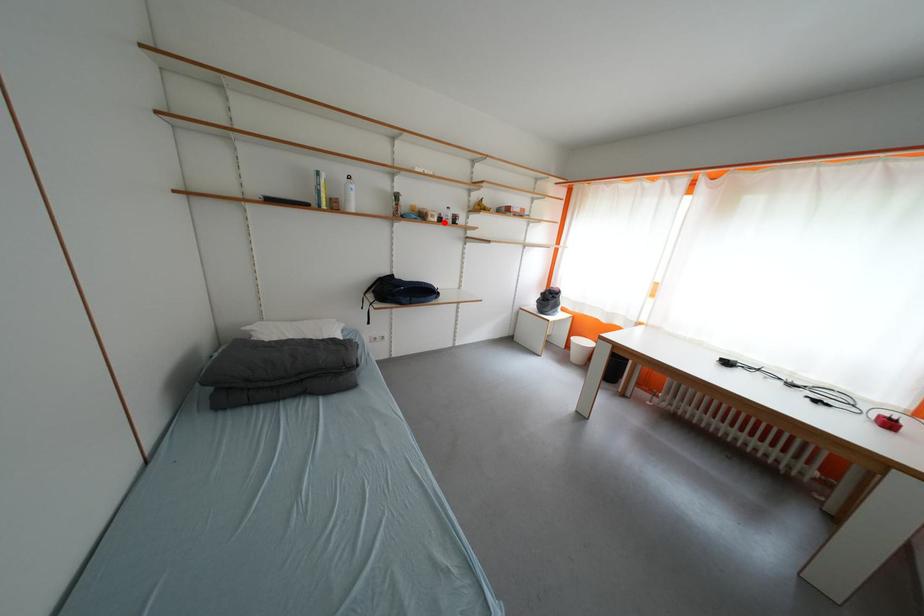
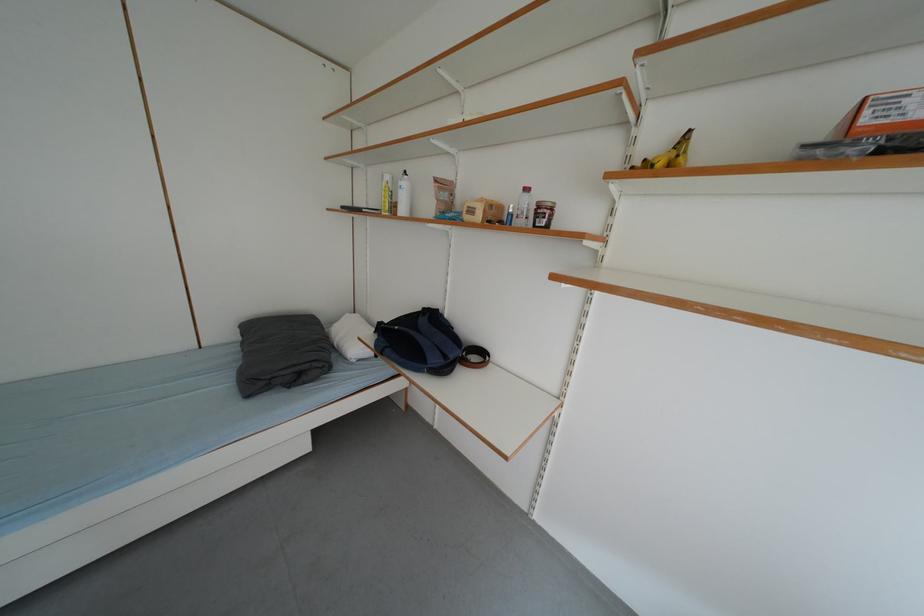
The point at the highlighted location is marked in the first image. Where is the corresponding point in the second image?

(487, 220)